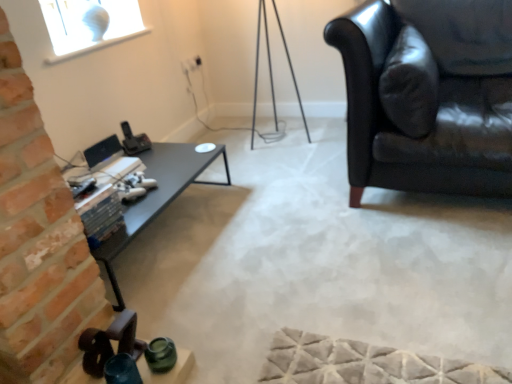
Question: Is point (153, 172) closer or farther from the camera than point (119, 147)?

Choices:
 (A) farther
 (B) closer

Answer: (B)

Question: From the image's perspective, is black glossy table at left positioned above or below satin black monitor at center?

Choices:
 (A) above
 (B) below

Answer: (B)

Question: Estimate the real-world distances between objects in this image. Which object is farther from the black glossy table at left?

Choices:
 (A) satin black monitor at center
 (B) black leather couch at right

Answer: (B)

Question: Which object is the closest to the satin black monitor at center?

Choices:
 (A) black leather couch at right
 (B) black glossy table at left

Answer: (B)